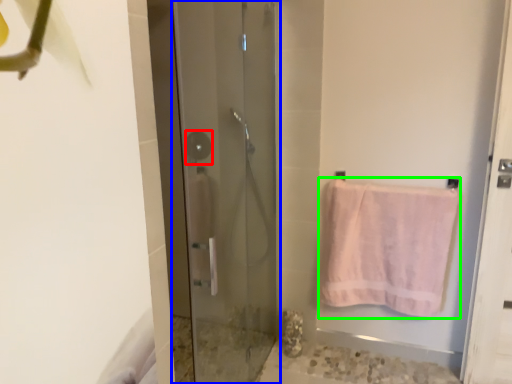
Question: Estimate the real-world distances between objects in this image. Which object is farther from shower (highlighted by a red box), door (highlighted by a blue box) or towel (highlighted by a green box)?

Choices:
 (A) door
 (B) towel

Answer: (B)